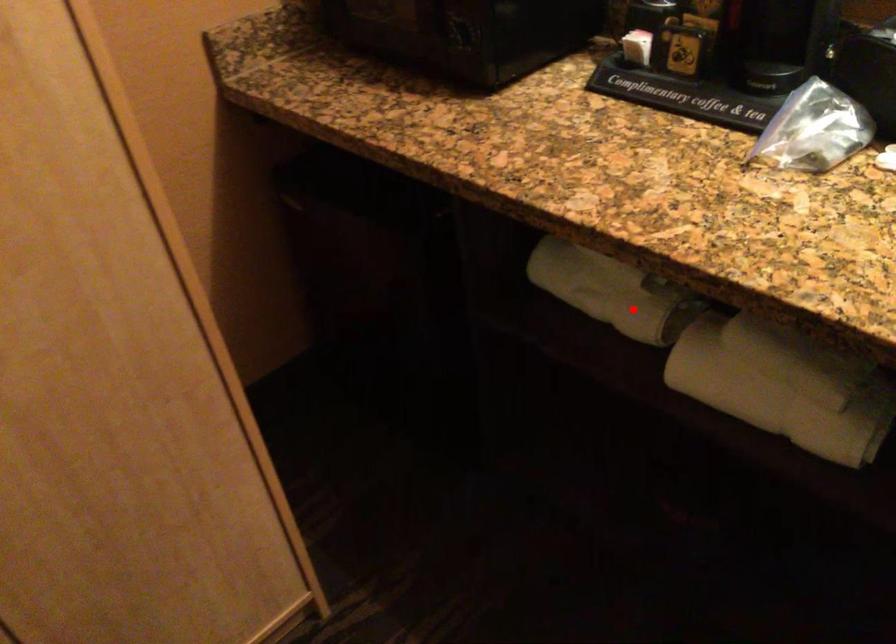
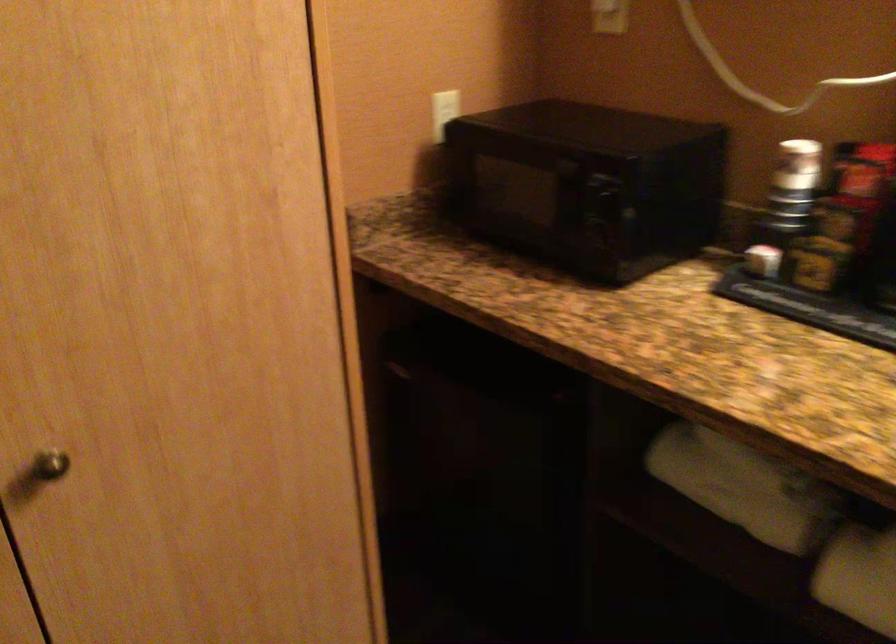
Find the pixel in the second image that matches the highlighted location in the first image.

(764, 509)